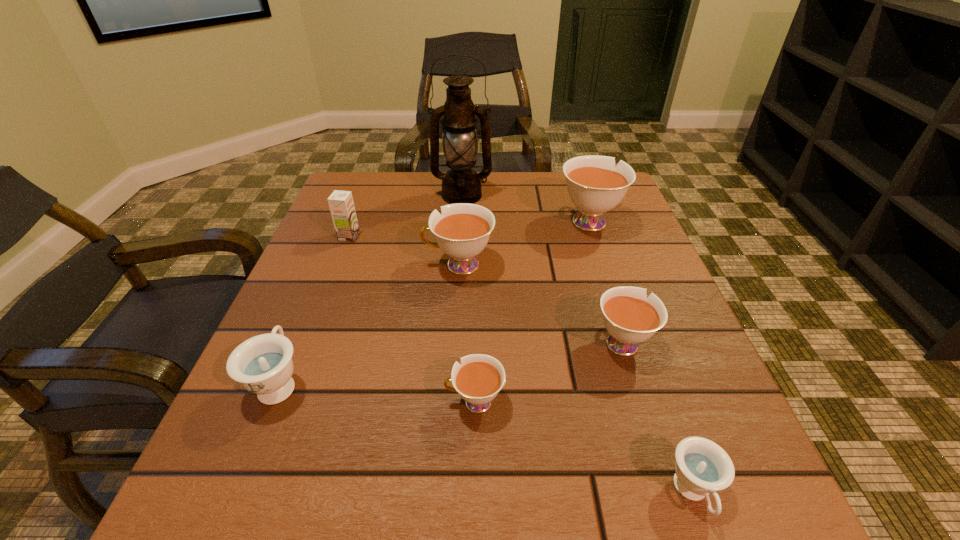
At what (x,y) coordinates should I click in order to perform the action: click on object that is the fifth closest one to the left blue teacup. Please return your answer as a coordinate pair (x, y). Image resolution: width=960 pixels, height=540 pixels. Looking at the image, I should click on (461, 184).

Identify which teacup is the fifth closest to the tallest object. Please provide its 2D coordinates. Your answer should be formatted as a tuple, i.e. [(x, y)], where the tuple contains the x and y coordinates of a point satisfying the conditions above.

[(478, 379)]

Identify the location of the sixth closest teacup to the tallest object. (702, 467).

Locate which white teacup ranks second in proximity to the brown oil lamp. Please provide its 2D coordinates. Your answer should be formatted as a tuple, i.e. [(x, y)], where the tuple contains the x and y coordinates of a point satisfying the conditions above.

[(462, 231)]

Identify which white teacup is located as the nearest to the oil lamp. Please provide its 2D coordinates. Your answer should be formatted as a tuple, i.e. [(x, y)], where the tuple contains the x and y coordinates of a point satisfying the conditions above.

[(594, 185)]

The width and height of the screenshot is (960, 540). I want to click on free spot that satisfies the following two spatial constraints: 1. on the back side of the brown oil lamp; 2. on the left side of the chocolate milk, so click(x=365, y=195).